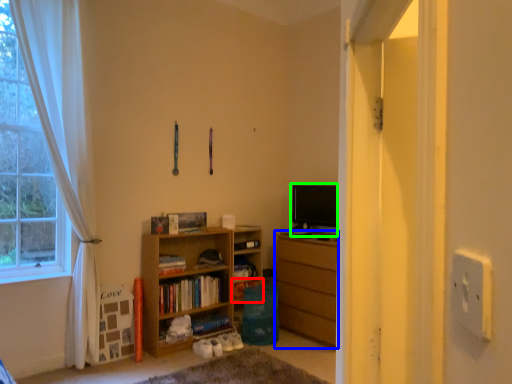
Question: Which is farther away from shelf (highlighted by a red box)? chest of drawers (highlighted by a blue box) or level (highlighted by a green box)?

Choices:
 (A) chest of drawers
 (B) level

Answer: (B)